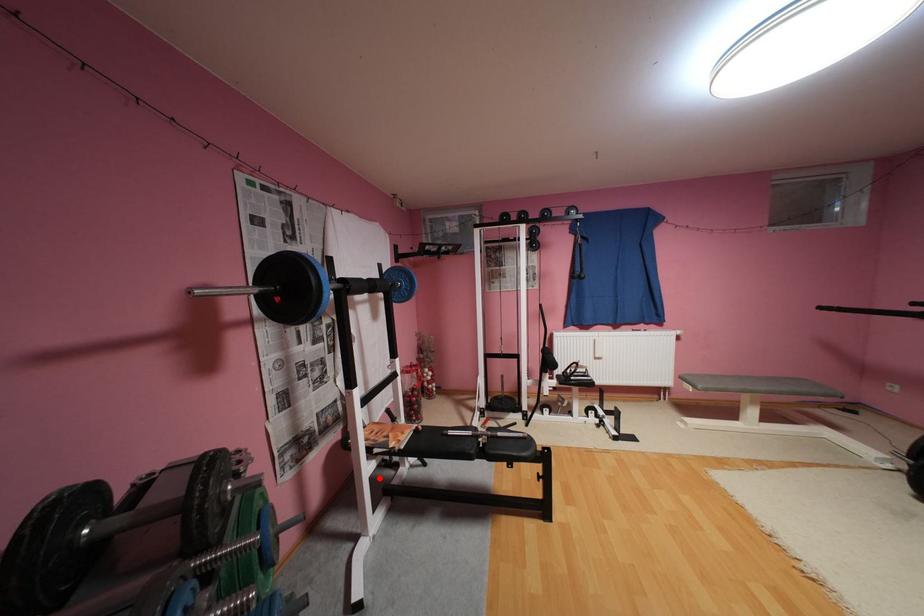
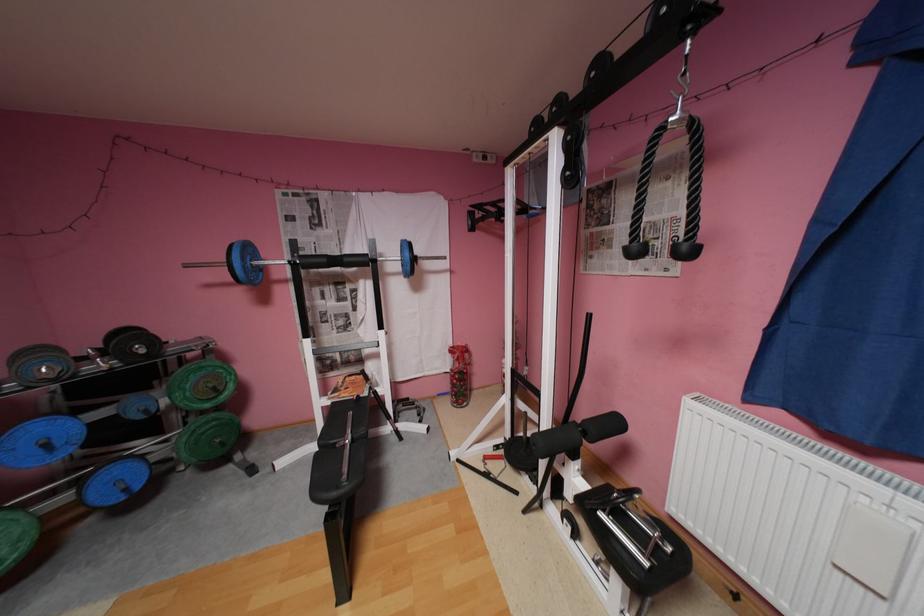
In the second image, find the point that corresponds to the highlighted location in the first image.

(333, 408)